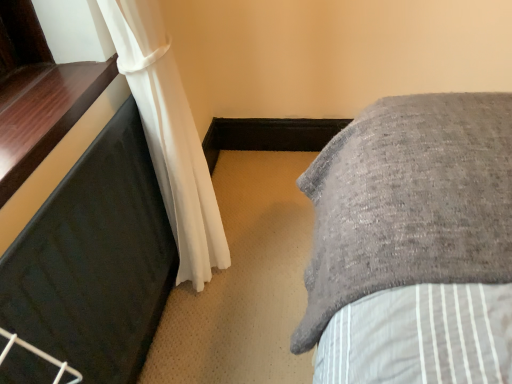
The height and width of the screenshot is (384, 512). What are the coordinates of `vacant space underneath white sheer curtain at left (from a real-world perspective)` in the screenshot? It's located at coord(215,269).